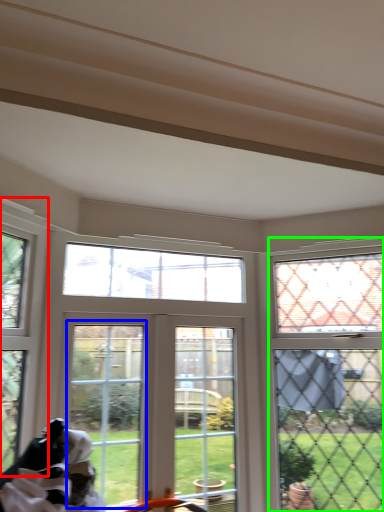
Question: Which object is positioned closest to window (highlighted by a red box)? Select from screen door (highlighted by a blue box) and window (highlighted by a green box).

Choices:
 (A) screen door
 (B) window

Answer: (A)